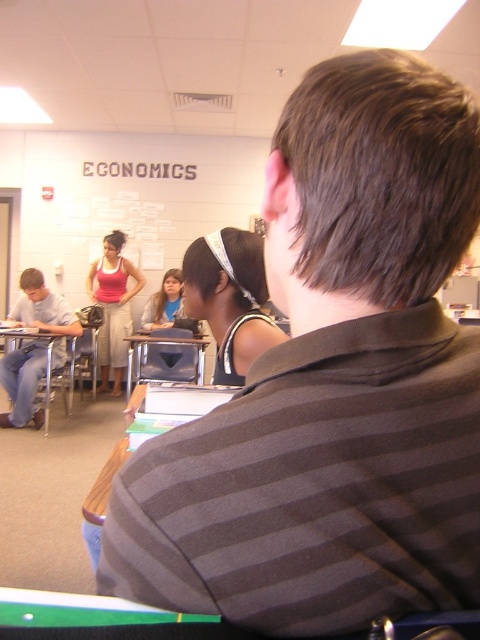
Describe the element at coordinates (83, 611) in the screenshot. I see `green felt table at lower left` at that location.

Can you confirm if green felt table at lower left is shorter than matte pink tank top at center?

Correct, green felt table at lower left is not as tall as matte pink tank top at center.

Between point (23, 598) and point (121, 364), which one is positioned in front?

Point (23, 598)

This screenshot has width=480, height=640. Find the location of `green felt table at lower left`. green felt table at lower left is located at coordinates click(83, 611).

Which of these two, white headband at center or matte pink tank top at center, stands taller?

Standing taller between the two is matte pink tank top at center.

Does white headband at center have a greater height compared to matte pink tank top at center?

No.

Image resolution: width=480 pixels, height=640 pixels. What are the coordinates of `white headband at center` in the screenshot? It's located at (229, 300).

Where is `white headband at center`? The image size is (480, 640). white headband at center is located at coordinates (229, 300).

Does point (144, 608) lie behind point (144, 342)?

No, it is in front of (144, 342).

Is point (22, 620) positioned after point (142, 340)?

No, it is in front of (142, 340).

I want to click on green felt table at lower left, so click(83, 611).